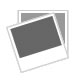
You are a GUI agent. You are given a task and a screenshot of the screen. Output one action in this format:
    pyautogui.click(x=<x>, y=<y>)
    Task: Click on the pictures
    
    Given the screenshot: What is the action you would take?
    pyautogui.click(x=46, y=36), pyautogui.click(x=65, y=18)